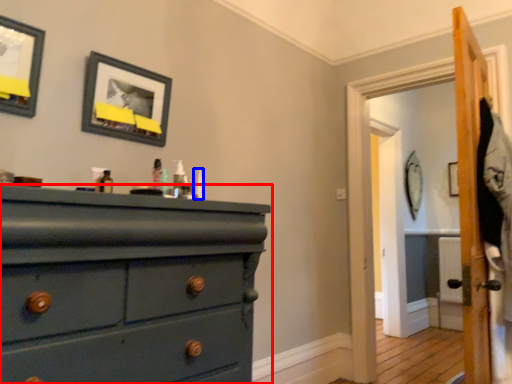
Question: Which point is closer to the camera, chest of drawers (highlighted by a red box) or toiletry (highlighted by a blue box)?

Choices:
 (A) chest of drawers
 (B) toiletry

Answer: (A)